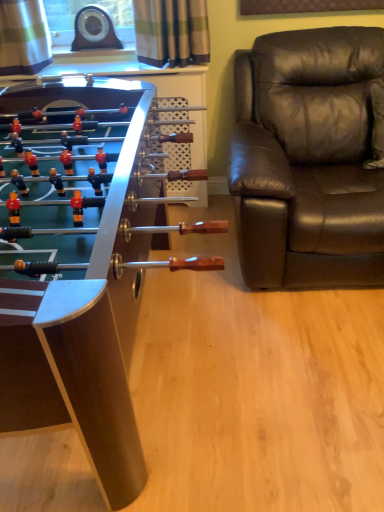
The width and height of the screenshot is (384, 512). Describe the element at coordinates (310, 159) in the screenshot. I see `brown leather chair at right` at that location.

What is the approximate width of brown leather chair at right?

1.02 meters.

Identify the location of brown leather chair at right. (310, 159).

In order to face metallic foosball table at left, should I rotate leftwards or rightwards?

You should rotate left by 18.331 degrees.

Describe the element at coordinates (81, 275) in the screenshot. The width and height of the screenshot is (384, 512). I see `metallic foosball table at left` at that location.

The height and width of the screenshot is (512, 384). I want to click on metallic foosball table at left, so click(x=81, y=275).

In order to click on brown leather chair at right in this screenshot , I will do `click(310, 159)`.

Is metallic foosball table at left to the left of brown leather chair at right from the viewer's perspective?

Yes, metallic foosball table at left is to the left of brown leather chair at right.

Is metallic foosball table at left further to camera compared to brown leather chair at right?

No, metallic foosball table at left is closer to the viewer.

Is point (129, 263) less distant than point (245, 83)?

Yes.

From the image's perspective, which one is positioned higher, metallic foosball table at left or brown leather chair at right?

brown leather chair at right.

From a real-world perspective, is metallic foosball table at left physically above brown leather chair at right?

No, from a real-world perspective, metallic foosball table at left is not over brown leather chair at right

Which of these two, metallic foosball table at left or brown leather chair at right, is thinner?

Thinner between the two is brown leather chair at right.

From their relative heights in the image, would you say metallic foosball table at left is taller or shorter than brown leather chair at right?

metallic foosball table at left is shorter than brown leather chair at right.

Does metallic foosball table at left have a larger size compared to brown leather chair at right?

Yes, metallic foosball table at left is bigger than brown leather chair at right.

Is metallic foosball table at left situated inside brown leather chair at right or outside?

metallic foosball table at left is spatially situated outside brown leather chair at right.

Are metallic foosball table at left and brown leather chair at right located far from each other?

Actually, metallic foosball table at left and brown leather chair at right are a little close together.

Is metallic foosball table at left turned away from brown leather chair at right?

That's not correct — metallic foosball table at left is not looking away from brown leather chair at right.

Measure the distance from metallic foosball table at left to brown leather chair at right.

metallic foosball table at left and brown leather chair at right are 30.59 inches apart from each other.

Identify the location of table in front of the brown leather chair at right. (81, 275).

Can you confirm if brown leather chair at right is positioned to the left of metallic foosball table at left?

Result: No, brown leather chair at right is not to the left of metallic foosball table at left.

Considering the positions of objects brown leather chair at right and metallic foosball table at left in the image provided, who is behind, brown leather chair at right or metallic foosball table at left?

brown leather chair at right is further away from the camera.

Which is behind, point (310, 87) or point (109, 424)?

The point (310, 87) is behind.

From the image's perspective, is brown leather chair at right beneath metallic foosball table at left?

No, from the image's perspective, brown leather chair at right is not beneath metallic foosball table at left.

From a real-world perspective, who is located lower, brown leather chair at right or metallic foosball table at left?

In real-world perspective, metallic foosball table at left is lower.

Which object is thinner, brown leather chair at right or metallic foosball table at left?

brown leather chair at right is thinner.

Between brown leather chair at right and metallic foosball table at left, which one has less height?

metallic foosball table at left.

Is brown leather chair at right smaller than metallic foosball table at left?

Yes, brown leather chair at right is smaller than metallic foosball table at left.

Is metallic foosball table at left located within brown leather chair at right?

No, metallic foosball table at left is not inside brown leather chair at right.

Is brown leather chair at right not near metallic foosball table at left?

They are positioned close to each other.

Is brown leather chair at right oriented towards metallic foosball table at left?

No, brown leather chair at right does not turn towards metallic foosball table at left.

How far apart are brown leather chair at right and metallic foosball table at left?

brown leather chair at right is 30.59 inches away from metallic foosball table at left.

This screenshot has width=384, height=512. I want to click on chair on the right of metallic foosball table at left, so click(310, 159).

Find the location of a particular element. table below the brown leather chair at right (from a real-world perspective) is located at coordinates pos(81,275).

The width and height of the screenshot is (384, 512). I want to click on chair above the metallic foosball table at left (from a real-world perspective), so click(x=310, y=159).